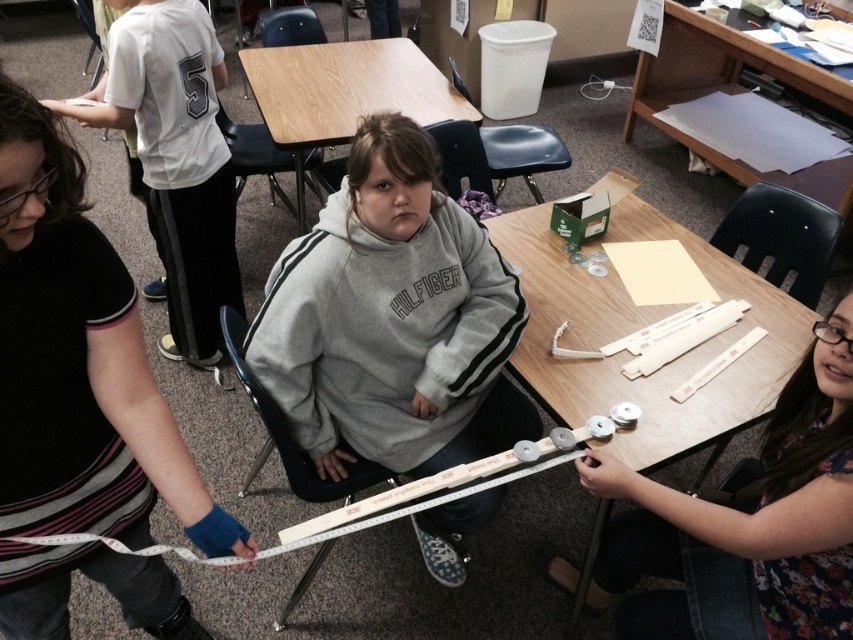
You are a student in the classroom and need to measure a 15 cm object. You have the white plastic ruler at lower right and the white cotton shirt at upper left. Which object should you use for measurement?

The white plastic ruler at lower right should be used for measurement since it is smaller than the white cotton shirt at upper left and appropriate for measuring small objects like 15 cm.